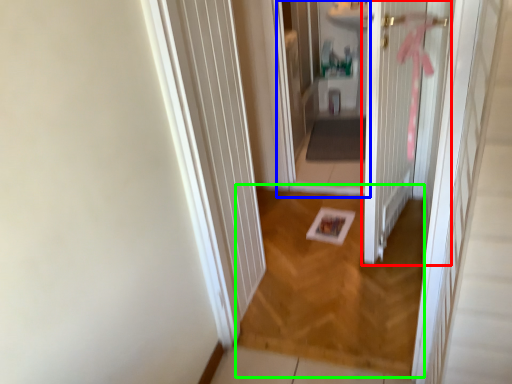
Question: Based on their relative distances, which object is nearer to door (highlighted by a red box)? Choose from corridor (highlighted by a blue box) and plain (highlighted by a green box).

Choices:
 (A) corridor
 (B) plain

Answer: (B)